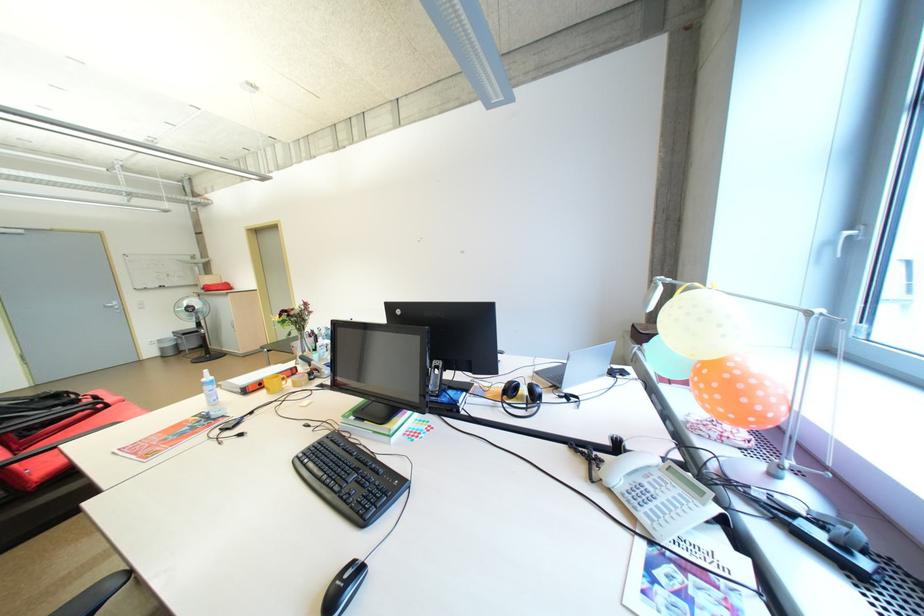
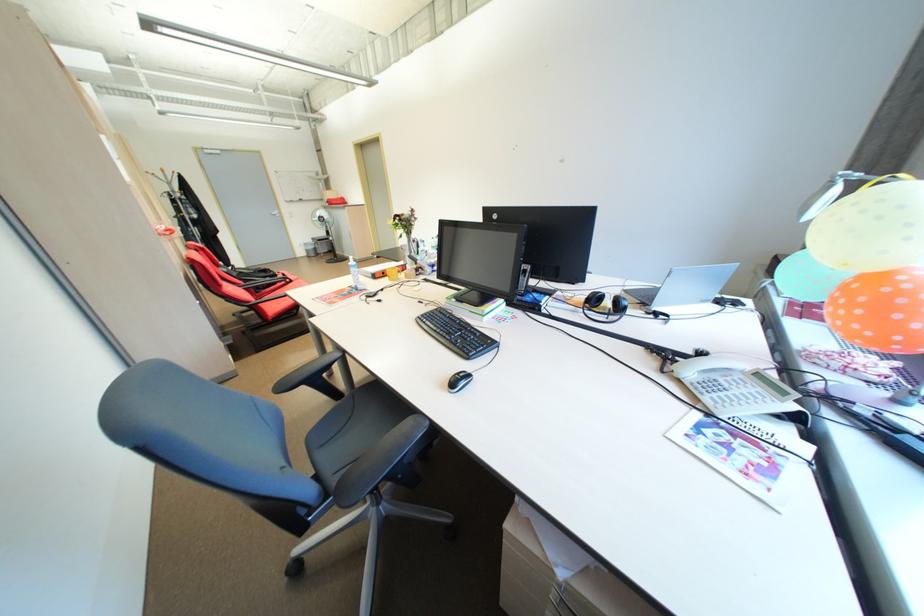
In the second image, find the point that corresponds to (x=710, y=320) in the first image.

(889, 219)